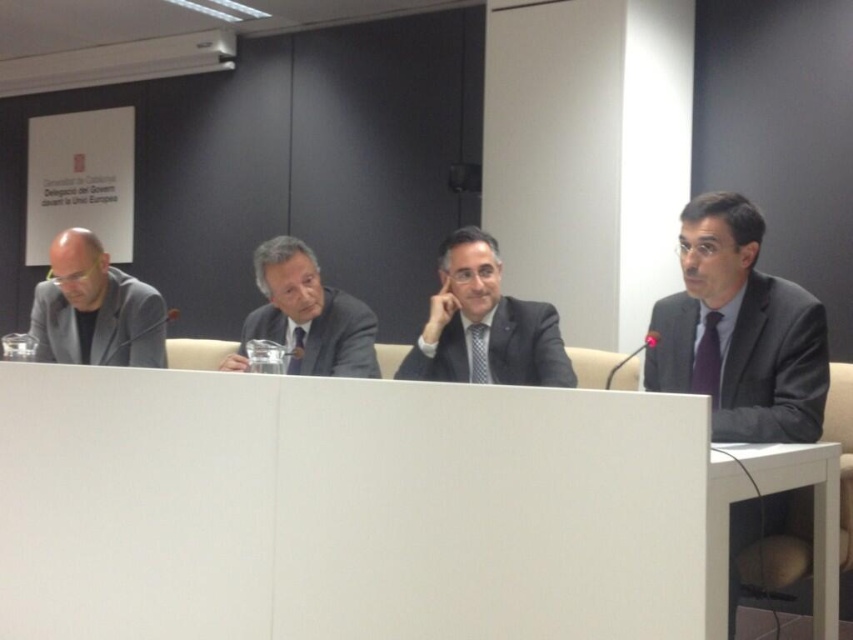
Can you confirm if white matte table at center is bigger than dark gray suit at center?

Indeed, white matte table at center has a larger size compared to dark gray suit at center.

Can you confirm if white matte table at center is positioned to the right of dark gray suit at center?

Indeed, white matte table at center is positioned on the right side of dark gray suit at center.

At what (x,y) coordinates should I click in order to perform the action: click on white matte table at center. Please return your answer as a coordinate pair (x, y). Looking at the image, I should click on (354, 509).

Does white matte table at center have a greater height compared to matte black suit at center?

Indeed, white matte table at center has a greater height compared to matte black suit at center.

This screenshot has width=853, height=640. I want to click on white matte table at center, so click(354, 509).

Locate an element on the screen. white matte table at center is located at coordinates (354, 509).

Does point (697, 464) come closer to viewer compared to point (822, 547)?

Yes, point (697, 464) is closer to viewer.

Is white matte table at center taller than white glossy table at lower right?

Correct, white matte table at center is much taller as white glossy table at lower right.

I want to click on white matte table at center, so click(354, 509).